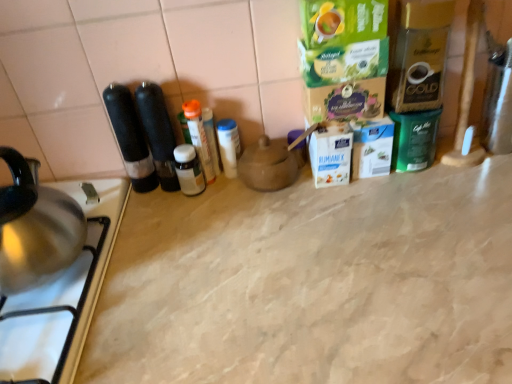
Identify the location of vacant region in front of matte brown teapot at center. The height and width of the screenshot is (384, 512). (280, 238).